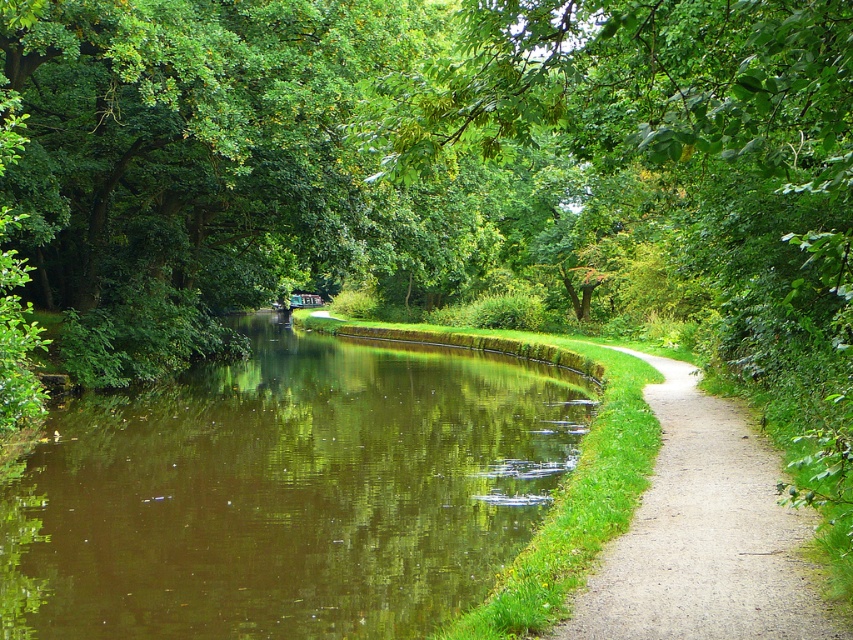
Does green leafy tree at center come behind gravel path at right?

No, green leafy tree at center is in front of gravel path at right.

Is point (769, 198) positioned behind point (735, 460)?

Yes, it is.

Image resolution: width=853 pixels, height=640 pixels. Identify the location of green leafy tree at center. (670, 180).

Is brown reflective water at center above gravel path at right?

Incorrect, brown reflective water at center is not positioned above gravel path at right.

Which of these two, brown reflective water at center or gravel path at right, stands shorter?

gravel path at right is shorter.

Is point (300, 532) behind point (820, 611)?

Yes, point (300, 532) is farther from viewer.

You are a GUI agent. You are given a task and a screenshot of the screen. Output one action in this format:
    pyautogui.click(x=<x>, y=<y>)
    Task: Click on the brown reflective water at center
    
    Given the screenshot: What is the action you would take?
    pyautogui.click(x=286, y=492)

Image resolution: width=853 pixels, height=640 pixels. Find the location of `brown reflective water at center`. brown reflective water at center is located at coordinates (286, 492).